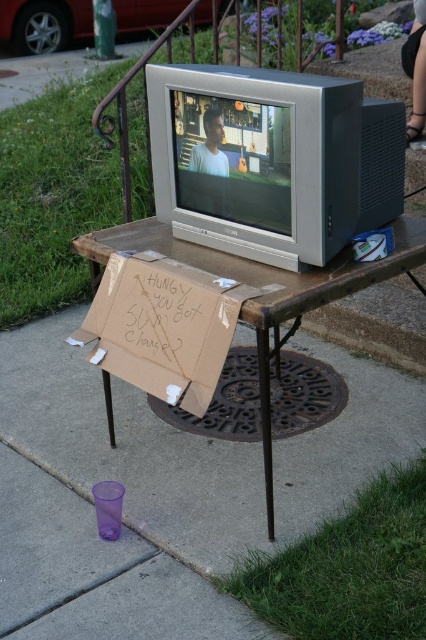
You are a person walking towards the table with the brown cardboard sign at center. There is also a purple plastic cup at lower left near the table. Which object will you encounter first as you approach the table?

The purple plastic cup at lower left is closer to the viewer than the brown cardboard sign at center, so you will encounter the purple plastic cup at lower left first as you approach the table.

You are a person walking towards the brown cardboard sign at center and the purple plastic cup at lower left. Which object will you encounter first?

You will encounter the brown cardboard sign at center first because the purple plastic cup at lower left is to the right of it, meaning the sign is closer to your path as you approach.